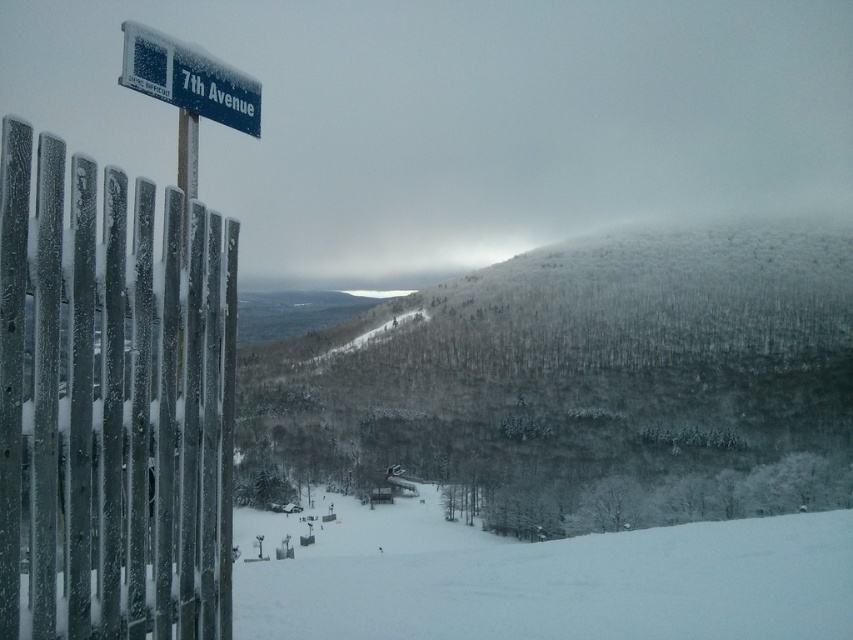
Locate an element on the screen. snow-covered forest at center is located at coordinates (589, 381).

Does snow-covered forest at center appear under white snow ski slope at center?

Actually, snow-covered forest at center is above white snow ski slope at center.

Which is in front, point (491, 385) or point (329, 618)?

Positioned in front is point (329, 618).

Where is `snow-covered forest at center`? The width and height of the screenshot is (853, 640). snow-covered forest at center is located at coordinates (589, 381).

Locate an element on the screen. white snow ski slope at center is located at coordinates (544, 579).

Does white snow ski slope at center appear on the left side of blue plastic street sign at upper left?

Indeed, white snow ski slope at center is positioned on the left side of blue plastic street sign at upper left.

Who is more distant from viewer, (451, 577) or (190, 67)?

Point (451, 577)

The height and width of the screenshot is (640, 853). What are the coordinates of `white snow ski slope at center` in the screenshot? It's located at (544, 579).

Can you confirm if snow-covered forest at center is smaller than blue plastic street sign at upper left?

Actually, snow-covered forest at center might be larger than blue plastic street sign at upper left.

Does snow-covered forest at center have a lesser height compared to blue plastic street sign at upper left?

Incorrect, snow-covered forest at center's height does not fall short of blue plastic street sign at upper left's.

At what (x,y) coordinates should I click in order to perform the action: click on snow-covered forest at center. Please return your answer as a coordinate pair (x, y). Image resolution: width=853 pixels, height=640 pixels. Looking at the image, I should click on point(589,381).